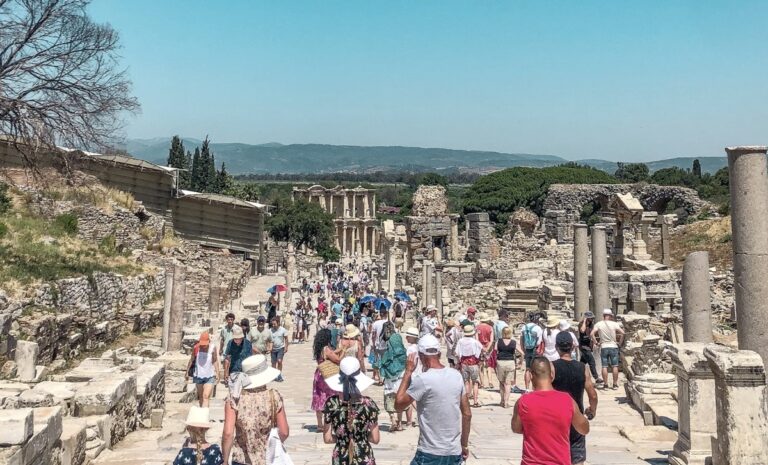
Identify the location of gray columns. This screenshot has height=465, width=768. (581, 274), (596, 245).